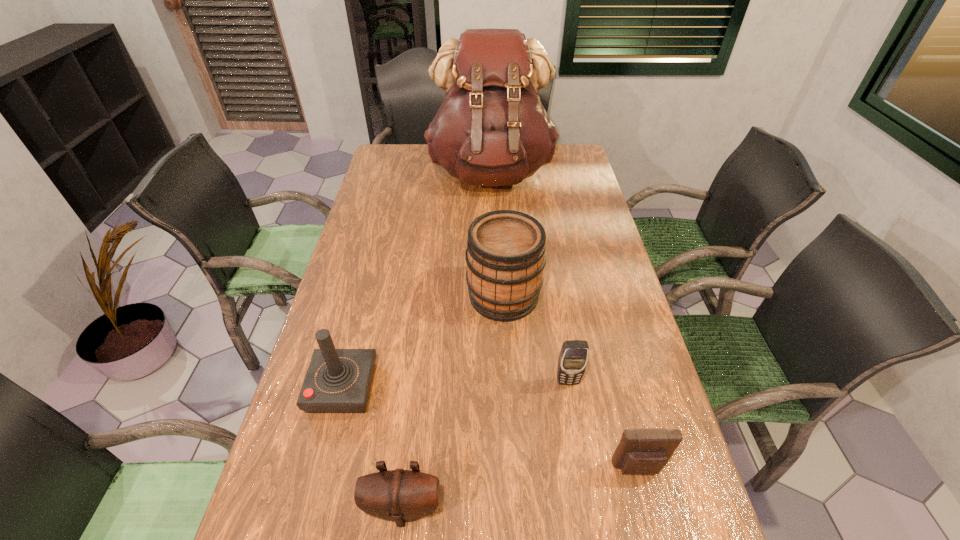
This screenshot has height=540, width=960. What are the coordinates of `satchel` in the screenshot? It's located at (491, 129).

Find the location of a particular element. the tallest object is located at coordinates (491, 129).

Locate an element on the screen. This screenshot has width=960, height=540. the second farthest object is located at coordinates (505, 256).

Locate an element on the screen. The width and height of the screenshot is (960, 540). the leftmost object is located at coordinates (338, 380).

Find the location of a particular element. the third tallest object is located at coordinates (338, 380).

The height and width of the screenshot is (540, 960). I want to click on cellular telephone, so click(x=573, y=357).

You are a GUI agent. You are given a task and a screenshot of the screen. Output one action in this format:
    pyautogui.click(x=<x>, y=<y>)
    Task: Click on the left pouch
    This screenshot has height=540, width=960.
    Given the screenshot: What is the action you would take?
    pyautogui.click(x=399, y=495)

This screenshot has width=960, height=540. I want to click on the nearer pouch, so click(x=399, y=495).

Identify the location of the farther pouch. This screenshot has height=540, width=960. (642, 451).

At what (x,y) coordinates should I click in order to perform the action: click on the right pouch. Please return your answer as a coordinate pair (x, y). This screenshot has height=540, width=960. Looking at the image, I should click on (642, 451).